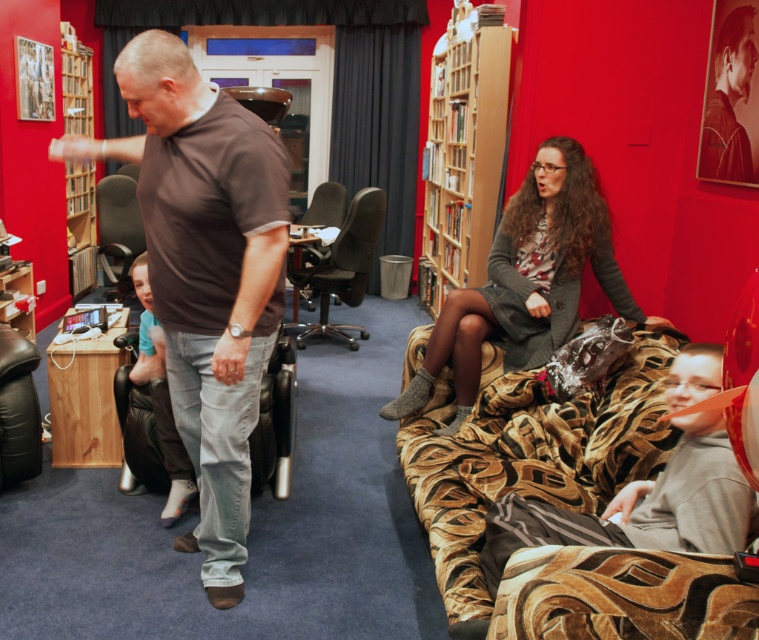
Question: Among these objects, which one is farthest from the camera?

Choices:
 (A) matte black office chair at center
 (B) dark gray fabric office chair at center
 (C) wooden bookshelf at left

Answer: (A)

Question: Can you confirm if black leather armchair at center is smaller than matte black office chair at center?

Choices:
 (A) no
 (B) yes

Answer: (A)

Question: Which object is closer to the camera taking this photo?

Choices:
 (A) smooth brown leather jacket at upper center
 (B) black leather armchair at center
 (C) velvet gold couch at lower right
 (D) matte black armchair at left

Answer: (C)

Question: Does velvet gold couch at lower right come behind wooden bookshelf at upper center?

Choices:
 (A) no
 (B) yes

Answer: (A)

Question: Does brown cotton shirt at left have a greater width compared to matte black armchair at left?

Choices:
 (A) yes
 (B) no

Answer: (A)

Question: Estimate the real-world distances between objects in this image. Which object is farther from the dark gray fabric office chair at center?

Choices:
 (A) smooth brown leather jacket at upper center
 (B) black leather armchair at center
 (C) brown cotton shirt at left
 (D) matte black armchair at left

Answer: (A)